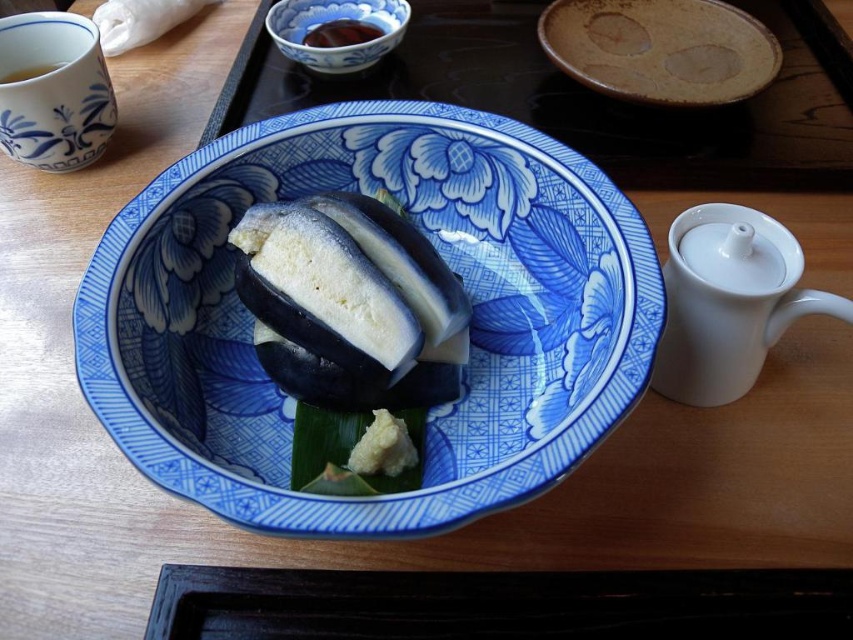
Is point (714, 49) closer to camera compared to point (351, 13)?

That is True.

Looking at this image, does brown matte platter at upper center have a larger size compared to blue porcelain bowl at upper center?

Correct, brown matte platter at upper center is larger in size than blue porcelain bowl at upper center.

Between point (749, 74) and point (335, 8), which one is positioned behind?

The point (335, 8) is behind.

The width and height of the screenshot is (853, 640). Find the location of `brown matte platter at upper center`. brown matte platter at upper center is located at coordinates (660, 49).

Between blue porcelain plate at center and brown glossy sauce at upper center, which one appears on the left side from the viewer's perspective?

brown glossy sauce at upper center is more to the left.

In the scene shown: Can you confirm if blue porcelain plate at center is positioned above brown glossy sauce at upper center?

Incorrect, blue porcelain plate at center is not positioned above brown glossy sauce at upper center.

Is point (119, 316) closer to viewer compared to point (334, 38)?

Yes, it is in front of point (334, 38).

Locate an element on the screen. The image size is (853, 640). blue porcelain plate at center is located at coordinates (444, 257).

Can you confirm if white creamy rice cake at center is positioned to the left of blue porcelain bowl at upper center?

Incorrect, white creamy rice cake at center is not on the left side of blue porcelain bowl at upper center.

Does white creamy rice cake at center appear on the right side of blue porcelain bowl at upper center?

Indeed, white creamy rice cake at center is positioned on the right side of blue porcelain bowl at upper center.

Is point (445, 397) farther from camera compared to point (300, 8)?

No.

Identify the location of white creamy rice cake at center. This screenshot has height=640, width=853. (358, 310).